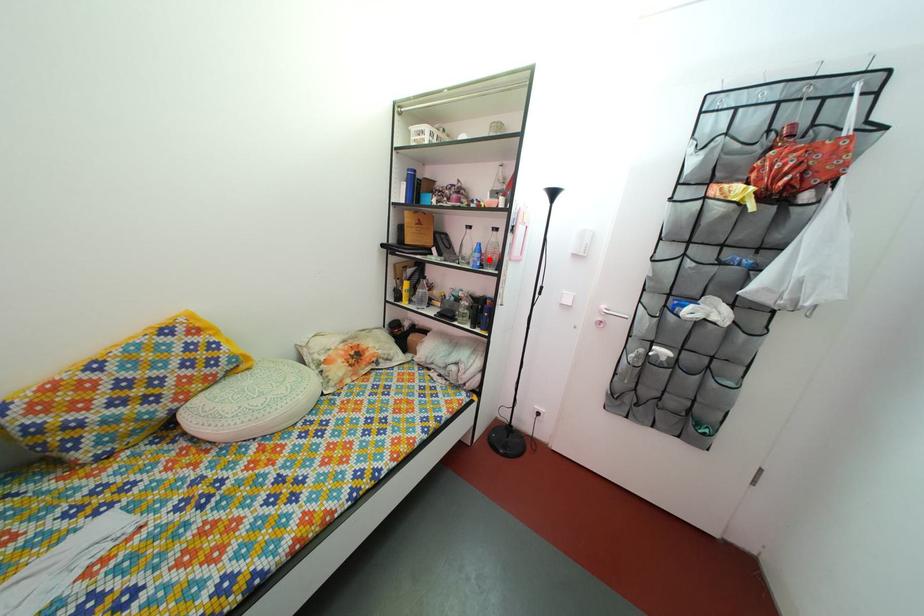
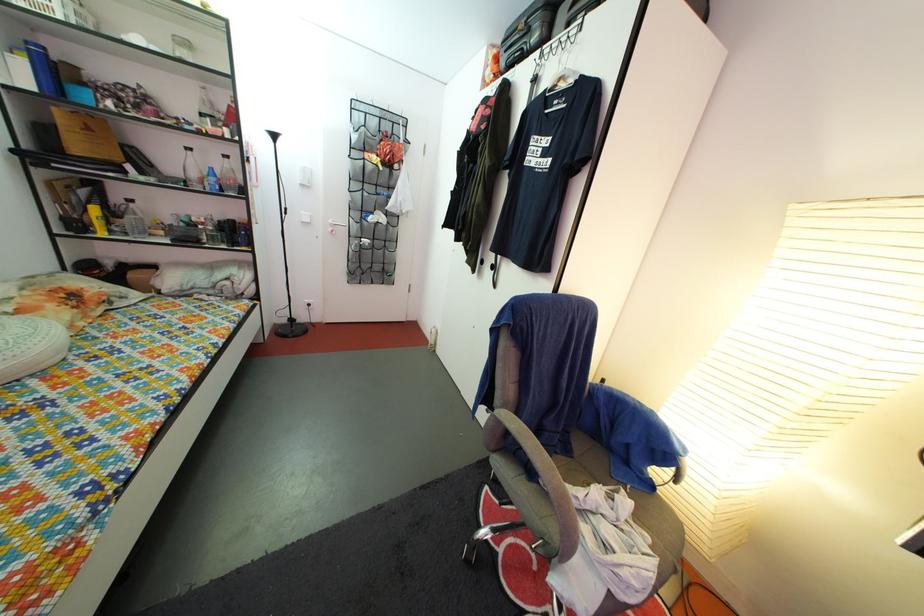
The point at the highlighted location is marked in the first image. Where is the corresponding point in the second image?

(225, 185)